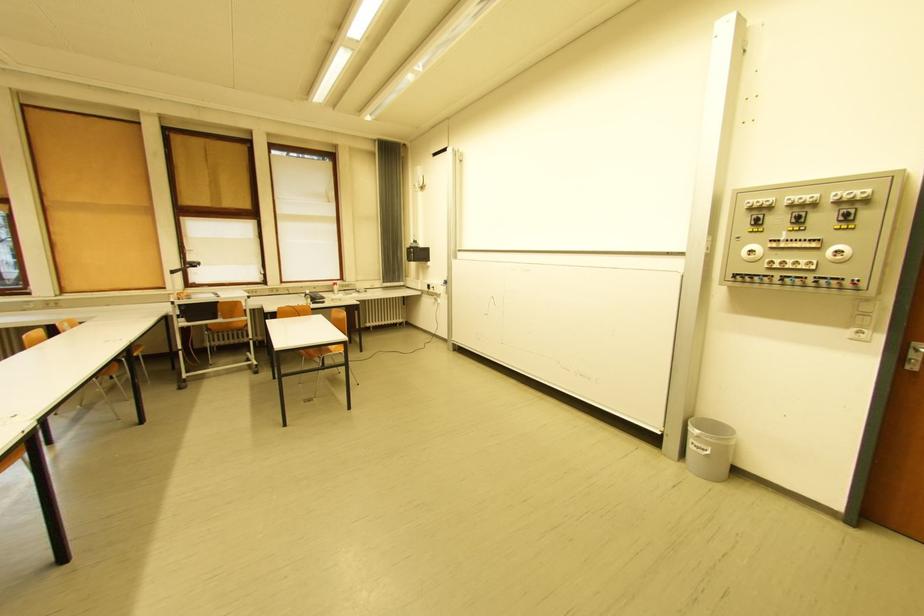
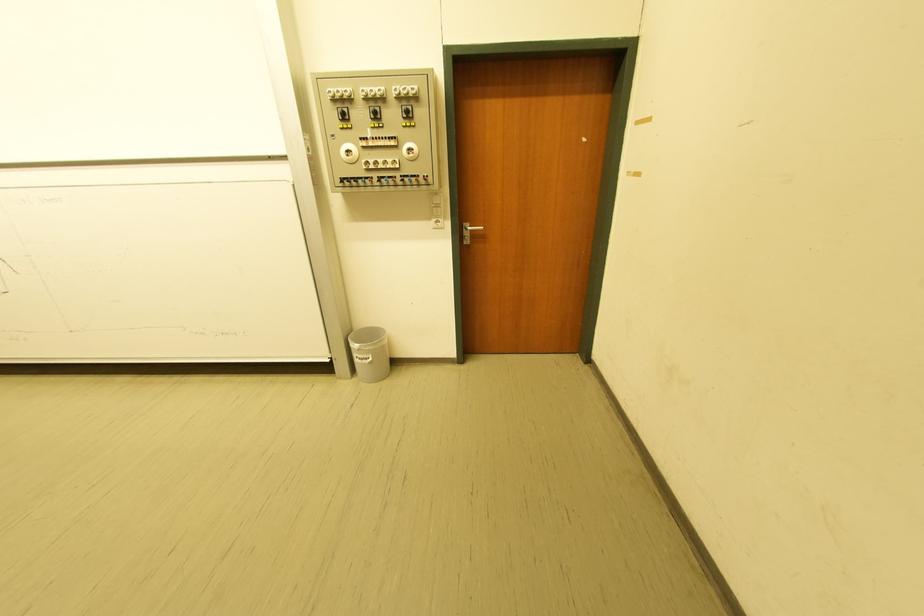
Question: I am providing you with two images of the same scene from different viewpoints. After the viewpoint changes to image2, which objects are now occluded?

Choices:
 (A) grey trash bin
 (B) black control switch
 (C) white control dial
 (D) none of these

Answer: (D)